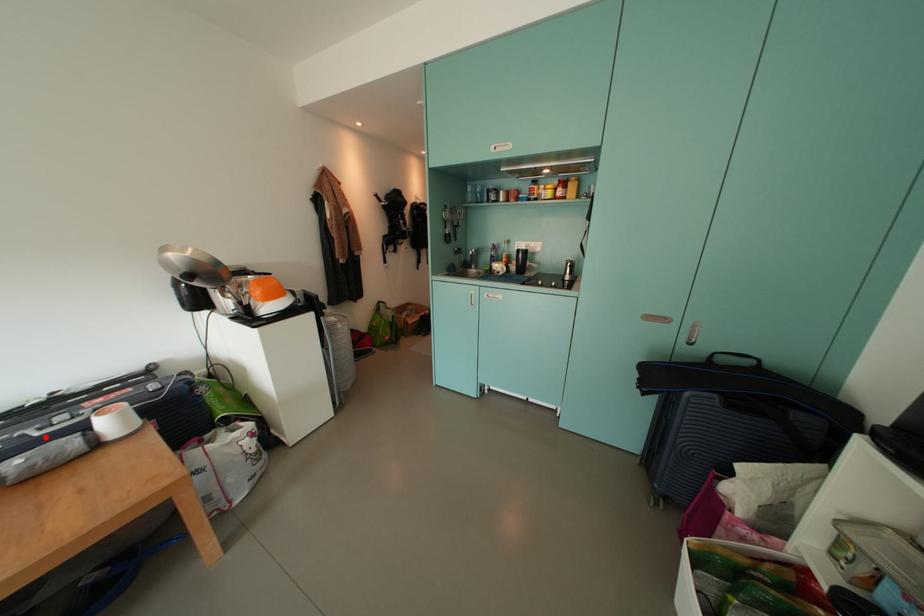
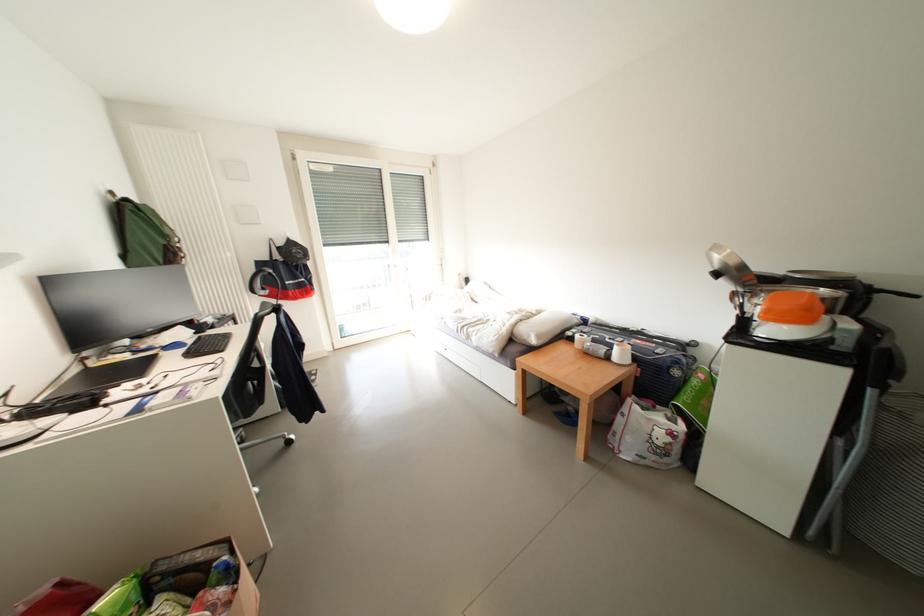
In the second image, find the point that corresponds to the highlighted location in the first image.

(614, 342)